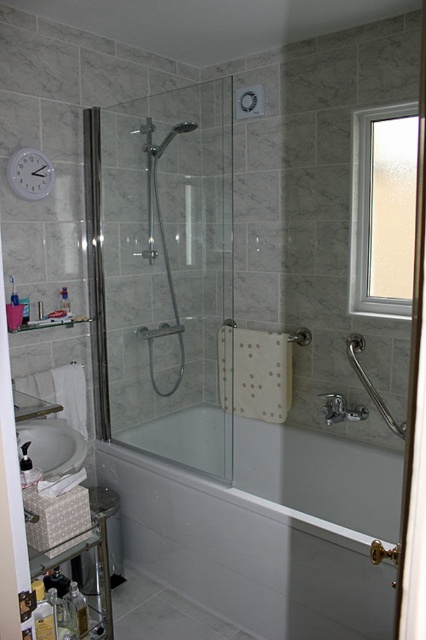
You are designing a bathroom layout and need to ensure that the clear glass shower door at center and the clear glass screen door at right are both installed. Based on the image, which of these two doors is taller?

The clear glass shower door at center is taller than the clear glass screen door at right, so the clear glass shower door at center is the taller one.

You are standing in the bathroom and want to enter the shower area. Which door should you open first, the clear glass shower door at center or the clear glass screen door at right?

The clear glass shower door at center is positioned on the left side of the clear glass screen door at right, so you should open the clear glass screen door at right first to access the shower area.